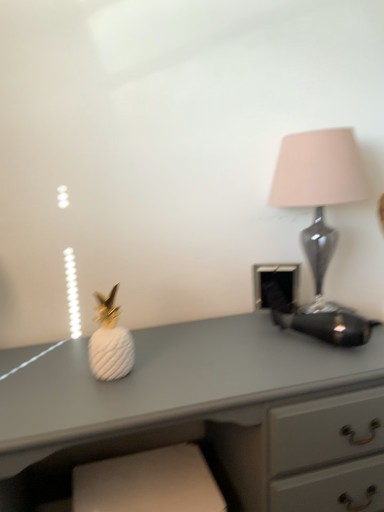
Question: Is white matte pineapple at left turned away from white matte pineapple at center?

Choices:
 (A) yes
 (B) no

Answer: (B)

Question: Is white matte pineapple at left aimed at white matte pineapple at center?

Choices:
 (A) yes
 (B) no

Answer: (B)

Question: Considering the relative sizes of white matte pineapple at left and white matte pineapple at center in the image provided, is white matte pineapple at left taller than white matte pineapple at center?

Choices:
 (A) no
 (B) yes

Answer: (B)

Question: Is white matte pineapple at left thinner than white matte pineapple at center?

Choices:
 (A) no
 (B) yes

Answer: (A)

Question: Considering the relative sizes of white matte pineapple at left and white matte pineapple at center in the image provided, is white matte pineapple at left smaller than white matte pineapple at center?

Choices:
 (A) no
 (B) yes

Answer: (A)

Question: Is the surface of white matte pineapple at left in direct contact with white matte pineapple at center?

Choices:
 (A) no
 (B) yes

Answer: (A)

Question: Does white matte pineapple at center lie in front of white matte pineapple at left?

Choices:
 (A) no
 (B) yes

Answer: (A)

Question: Does white matte pineapple at center come behind white matte pineapple at left?

Choices:
 (A) no
 (B) yes

Answer: (B)

Question: Is white matte pineapple at center facing away from white matte pineapple at left?

Choices:
 (A) no
 (B) yes

Answer: (A)

Question: Is white matte pineapple at center outside of white matte pineapple at left?

Choices:
 (A) yes
 (B) no

Answer: (A)

Question: Does white matte pineapple at center have a greater height compared to white matte pineapple at left?

Choices:
 (A) yes
 (B) no

Answer: (B)

Question: From the image's perspective, is white matte pineapple at center under white matte pineapple at left?

Choices:
 (A) no
 (B) yes

Answer: (A)

Question: Does matte glass lamp at right have a greater width compared to white matte pineapple at center?

Choices:
 (A) yes
 (B) no

Answer: (A)